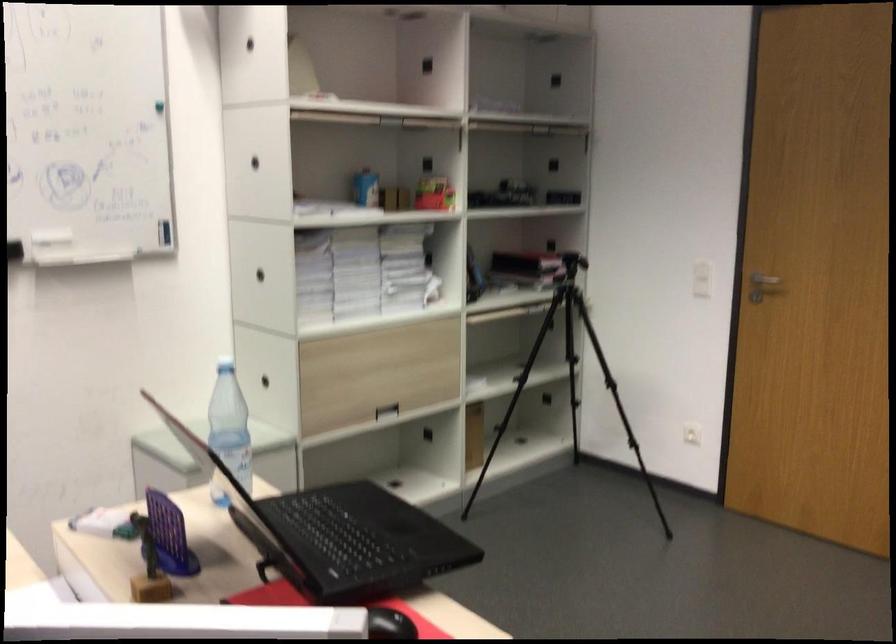
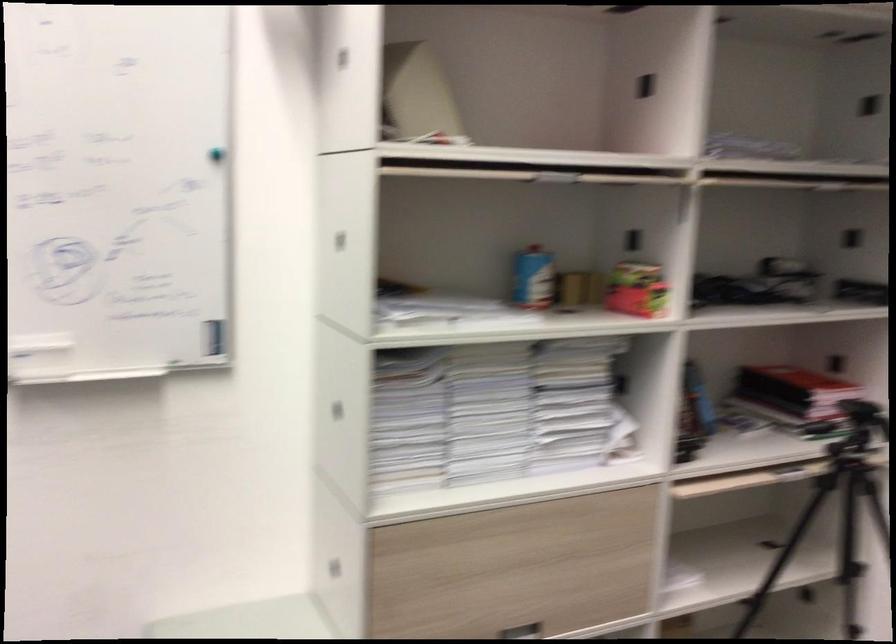
Where in the second image is the point corresponding to [357,270] from the first image?

(489, 412)